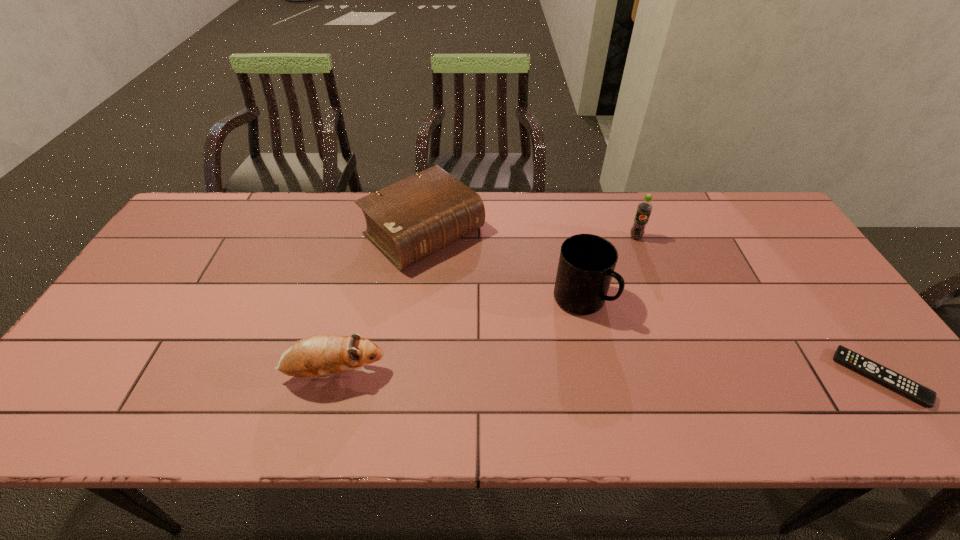
You are a GUI agent. You are given a task and a screenshot of the screen. Output one action in this format:
    pyautogui.click(x=<x>, y=<y>)
    Task: Click on the vacant space on the desktop that is between the hamster and the remote control and is positioned on the spine side of the Bible
    This screenshot has height=540, width=960.
    Given the screenshot: What is the action you would take?
    pyautogui.click(x=584, y=376)

Find the location of a particular element. The image size is (960, 540). free space on the desktop that is between the hamster and the rightmost object and is positioned on the side of the third object from right to left with the handle is located at coordinates (682, 376).

Find the location of a particular element. This screenshot has width=960, height=540. free space on the desktop that is between the hamster and the rightmost object and is positioned on the front label of the soda is located at coordinates [644, 376].